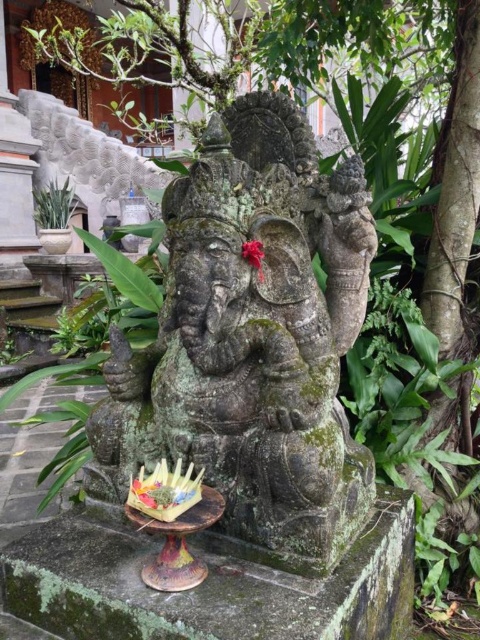
Question: Which point is farther from the camera taking this photo?

Choices:
 (A) (51, 228)
 (B) (235, 506)

Answer: (A)

Question: Among these objects, which one is farthest from the camera?

Choices:
 (A) green mossy stone statue at center
 (B) green leafy plant at left

Answer: (B)

Question: Can you confirm if green mossy stone statue at center is wider than green leafy plant at left?

Choices:
 (A) yes
 (B) no

Answer: (A)

Question: Can you confirm if green mossy stone statue at center is bigger than green leafy plant at left?

Choices:
 (A) no
 (B) yes

Answer: (B)

Question: Does green mossy stone statue at center appear over green leafy plant at left?

Choices:
 (A) no
 (B) yes

Answer: (A)